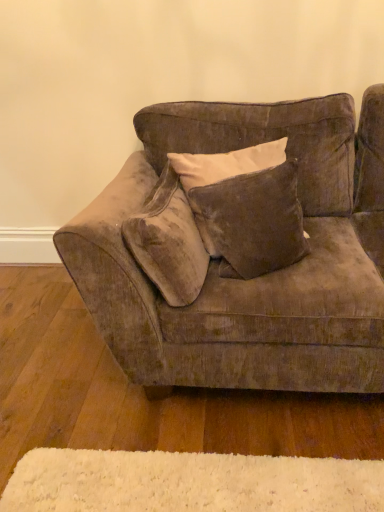
Image resolution: width=384 pixels, height=512 pixels. What do you see at coordinates (252, 279) in the screenshot? I see `velvet brown couch at center` at bounding box center [252, 279].

Measure the distance between point (233, 362) and camera.

The distance of point (233, 362) from camera is 1.41 meters.

The height and width of the screenshot is (512, 384). I want to click on velvet brown couch at center, so click(x=252, y=279).

The image size is (384, 512). In order to click on pillow that is the 1st one when counting backward from the white fluffy mat at lower center in this screenshot , I will do `click(168, 242)`.

Between white fluffy mat at lower center and velvet beige pillow at center, the first pillow viewed from the left, which one has smaller width?

velvet beige pillow at center, the first pillow viewed from the left, is thinner.

Considering the relative sizes of white fluffy mat at lower center and velvet beige pillow at center, the 2th pillow from the right, in the image provided, is white fluffy mat at lower center bigger than velvet beige pillow at center, the 2th pillow from the right,?

Actually, white fluffy mat at lower center might be smaller than velvet beige pillow at center, the 2th pillow from the right.

Is velvet beige pillow at center, the first pillow viewed from the left, a part of white fluffy mat at lower center?

No, velvet beige pillow at center, the first pillow viewed from the left, is not a part of white fluffy mat at lower center.

Is white fluffy mat at lower center further to the viewer compared to velvet brown pillow at center, the first pillow from the right?

No, white fluffy mat at lower center is in front of velvet brown pillow at center, the first pillow from the right.

Is point (362, 499) behind point (265, 266)?

No, (362, 499) is closer to viewer.

Considering the relative sizes of white fluffy mat at lower center and velvet brown pillow at center, the first pillow from the right, in the image provided, is white fluffy mat at lower center wider than velvet brown pillow at center, the first pillow from the right,?

Correct, the width of white fluffy mat at lower center exceeds that of velvet brown pillow at center, the first pillow from the right.

From the image's perspective, relative to velvet brown pillow at center, the first pillow from the right, is white fluffy mat at lower center above or below?

white fluffy mat at lower center is below velvet brown pillow at center, the first pillow from the right.

Which of these two, velvet beige pillow at center, the first pillow viewed from the left, or velvet brown couch at center, stands shorter?

Standing shorter between the two is velvet beige pillow at center, the first pillow viewed from the left.

Considering the sizes of objects velvet beige pillow at center, the first pillow viewed from the left, and velvet brown couch at center in the image provided, who is bigger, velvet beige pillow at center, the first pillow viewed from the left, or velvet brown couch at center?

With larger size is velvet brown couch at center.

Image resolution: width=384 pixels, height=512 pixels. What are the coordinates of `the 1st pillow above when counting from the velvet brown couch at center (from the image's perspective)` in the screenshot? It's located at (168, 242).

Looking at their sizes, would you say velvet beige pillow at center, the 2th pillow from the right, is wider or thinner than white fluffy mat at lower center?

A: Clearly, velvet beige pillow at center, the 2th pillow from the right, has less width compared to white fluffy mat at lower center.

Is velvet beige pillow at center, the first pillow viewed from the left, oriented away from white fluffy mat at lower center?

No.

From a real-world perspective, which is physically below, velvet beige pillow at center, the 2th pillow from the right, or white fluffy mat at lower center?

white fluffy mat at lower center is physically lower.

From their relative heights in the image, would you say velvet beige pillow at center, the 2th pillow from the right, is taller or shorter than white fluffy mat at lower center?

velvet beige pillow at center, the 2th pillow from the right, is taller than white fluffy mat at lower center.

Is white fluffy mat at lower center to the left or to the right of velvet brown couch at center in the image?

white fluffy mat at lower center is positioned on velvet brown couch at center's left side.

Does white fluffy mat at lower center have a greater width compared to velvet brown couch at center?

Correct, the width of white fluffy mat at lower center exceeds that of velvet brown couch at center.

Is white fluffy mat at lower center closer to camera compared to velvet brown couch at center?

That is False.

From the image's perspective, relative to velvet brown couch at center, is velvet brown pillow at center, which appears as the 2th pillow when viewed from the left, above or below?

From the image's perspective, velvet brown pillow at center, which appears as the 2th pillow when viewed from the left, appears above velvet brown couch at center.

Is point (271, 222) behind point (102, 266)?

Yes.

Considering the sizes of velvet brown pillow at center, which appears as the 2th pillow when viewed from the left, and velvet brown couch at center in the image, is velvet brown pillow at center, which appears as the 2th pillow when viewed from the left, taller or shorter than velvet brown couch at center?

Clearly, velvet brown pillow at center, which appears as the 2th pillow when viewed from the left, is shorter compared to velvet brown couch at center.

Is velvet brown pillow at center, the first pillow from the right, beside velvet brown couch at center?

They are not placed beside each other.

Considering the relative sizes of velvet brown couch at center and velvet brown pillow at center, the first pillow from the right, in the image provided, is velvet brown couch at center thinner than velvet brown pillow at center, the first pillow from the right,?

No.

Considering the sizes of velvet brown couch at center and velvet brown pillow at center, which appears as the 2th pillow when viewed from the left, in the image, is velvet brown couch at center taller or shorter than velvet brown pillow at center, which appears as the 2th pillow when viewed from the left,?

Considering their sizes, velvet brown couch at center has more height than velvet brown pillow at center, which appears as the 2th pillow when viewed from the left.

From the image's perspective, which one is positioned higher, velvet brown couch at center or velvet brown pillow at center, the first pillow from the right?

From the image's view, velvet brown pillow at center, the first pillow from the right, is above.

You are a GUI agent. You are given a task and a screenshot of the screen. Output one action in this format:
    pyautogui.click(x=<x>, y=<y>)
    Task: Click on the pillow on the left of white fluffy mat at lower center
    Image resolution: width=384 pixels, height=512 pixels.
    Given the screenshot: What is the action you would take?
    [x=168, y=242]

Find the location of a particular element. The image size is (384, 512). pillow that is the 2nd one when counting backward from the white fluffy mat at lower center is located at coordinates (252, 221).

From the image, which object appears to be farther from velvet brown couch at center, velvet brown pillow at center, the first pillow from the right, or white fluffy mat at lower center?

white fluffy mat at lower center is further to velvet brown couch at center.

Consider the image. Considering their positions, is velvet brown couch at center positioned further to velvet beige pillow at center, the 2th pillow from the right, than velvet brown pillow at center, the first pillow from the right?

velvet brown couch at center.

Based on their spatial positions, is velvet brown couch at center or velvet brown pillow at center, which appears as the 2th pillow when viewed from the left, further from white fluffy mat at lower center?

Among the two, velvet brown pillow at center, which appears as the 2th pillow when viewed from the left, is located further to white fluffy mat at lower center.

Considering their positions, is velvet beige pillow at center, the first pillow viewed from the left, positioned closer to velvet brown pillow at center, which appears as the 2th pillow when viewed from the left, than velvet brown couch at center?

velvet beige pillow at center, the first pillow viewed from the left, is positioned closer to the anchor velvet brown pillow at center, which appears as the 2th pillow when viewed from the left.

Based on their spatial positions, is velvet brown pillow at center, which appears as the 2th pillow when viewed from the left, or velvet brown couch at center closer to velvet beige pillow at center, the first pillow viewed from the left?

velvet brown pillow at center, which appears as the 2th pillow when viewed from the left, is closer to velvet beige pillow at center, the first pillow viewed from the left.

Estimate the real-world distances between objects in this image. Which object is closer to velvet brown pillow at center, the first pillow from the right, white fluffy mat at lower center or velvet beige pillow at center, the 2th pillow from the right?

Among the two, velvet beige pillow at center, the 2th pillow from the right, is located nearer to velvet brown pillow at center, the first pillow from the right.

Based on their spatial positions, is white fluffy mat at lower center or velvet beige pillow at center, the 2th pillow from the right, further from velvet brown couch at center?

white fluffy mat at lower center lies further to velvet brown couch at center than the other object.

Looking at this image, considering their positions, is velvet brown couch at center positioned further to white fluffy mat at lower center than velvet beige pillow at center, the first pillow viewed from the left?

The object further to white fluffy mat at lower center is velvet beige pillow at center, the first pillow viewed from the left.

The image size is (384, 512). Find the location of `studio couch between velvet brown pillow at center, the first pillow from the right, and white fluffy mat at lower center in the up-down direction`. studio couch between velvet brown pillow at center, the first pillow from the right, and white fluffy mat at lower center in the up-down direction is located at coordinates (252, 279).

At what (x,y) coordinates should I click in order to perform the action: click on pillow between velvet brown pillow at center, which appears as the 2th pillow when viewed from the left, and white fluffy mat at lower center in the up-down direction. Please return your answer as a coordinate pair (x, y). Looking at the image, I should click on (168, 242).

This screenshot has width=384, height=512. What are the coordinates of `pillow situated between velvet beige pillow at center, the 2th pillow from the right, and velvet brown couch at center from left to right` in the screenshot? It's located at (252, 221).

At what (x,y) coordinates should I click in order to perform the action: click on studio couch that lies between velvet beige pillow at center, the first pillow viewed from the left, and white fluffy mat at lower center from top to bottom. Please return your answer as a coordinate pair (x, y). Looking at the image, I should click on (252, 279).